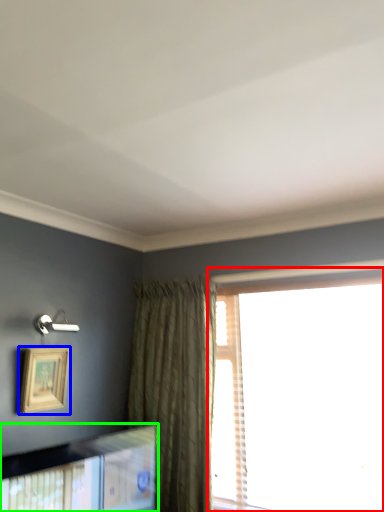
Question: Which is nearer to the window (highlighted by a red box)? picture frame (highlighted by a blue box) or picture frame (highlighted by a green box).

Choices:
 (A) picture frame
 (B) picture frame

Answer: (B)